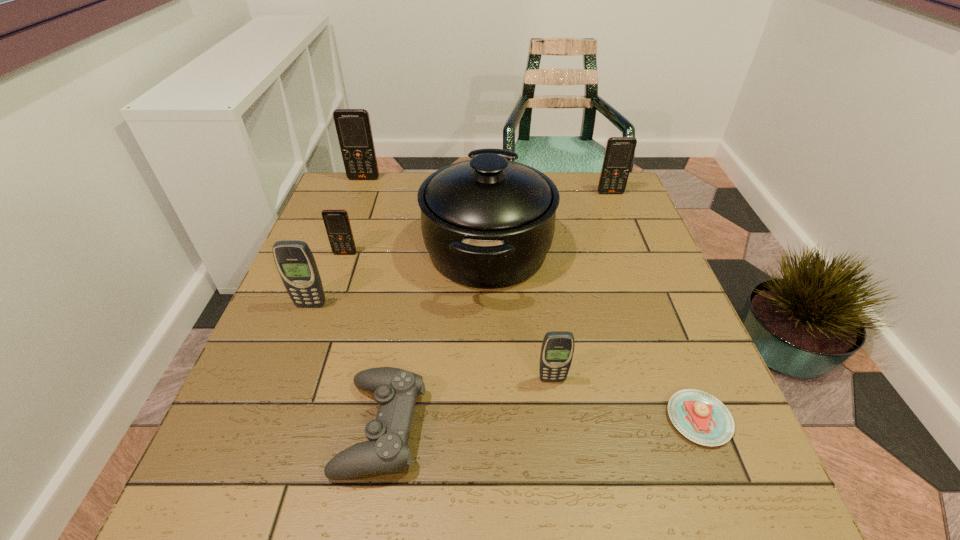
Identify the location of free space that satisfies the following two spatial constraints: 1. on the screen of the seventh tallest object; 2. on the right side of the tallest cellular telephone. Image resolution: width=960 pixels, height=540 pixels. (272, 427).

Find the location of a particular element. free spot that satisfies the following two spatial constraints: 1. on the screen of the farthest cellular telephone; 2. on the left side of the seventh tallest object is located at coordinates (272, 427).